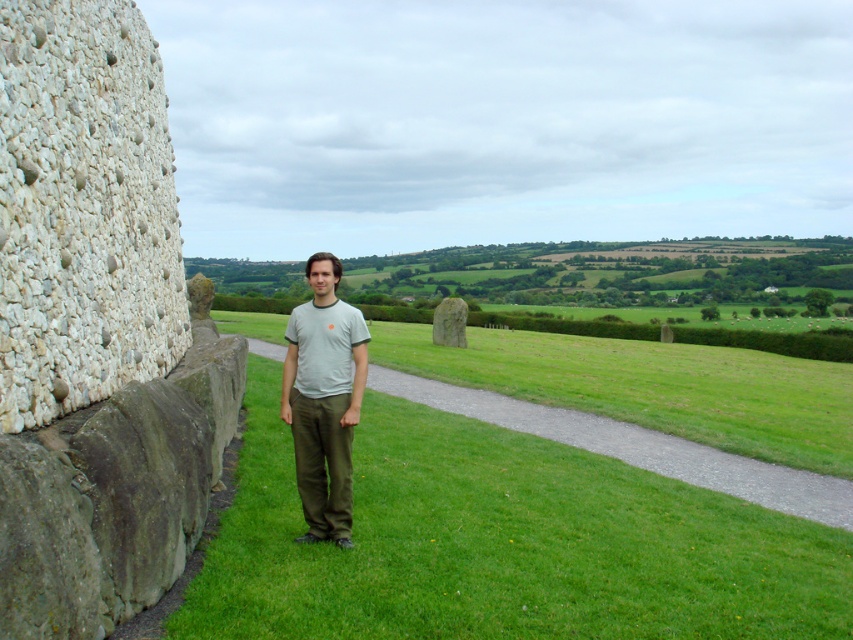
You are navigating a small drone that needs to fly from point A to point B in this rural landscape. The coordinates for point A are point (412,371) and for point B are point (355,330). Considering the terrain, which direction should the drone move to get closer to point B?

The drone should move towards the lower left direction since point (412,371) is further to the viewer than point (355,330), meaning it needs to go towards the background to reach point B.

You are standing at the origin point of the image coordinate system. The origin is at the bottom left corner of the image. You want to walk to the green grass at center. In which direction should you move relative to the current position?

The green grass at center is located at coordinate point 0.630 on the x axis and 0.766 on the y axis. Since the origin is at the bottom left corner, moving towards the right and upwards would lead you to the green grass at center.